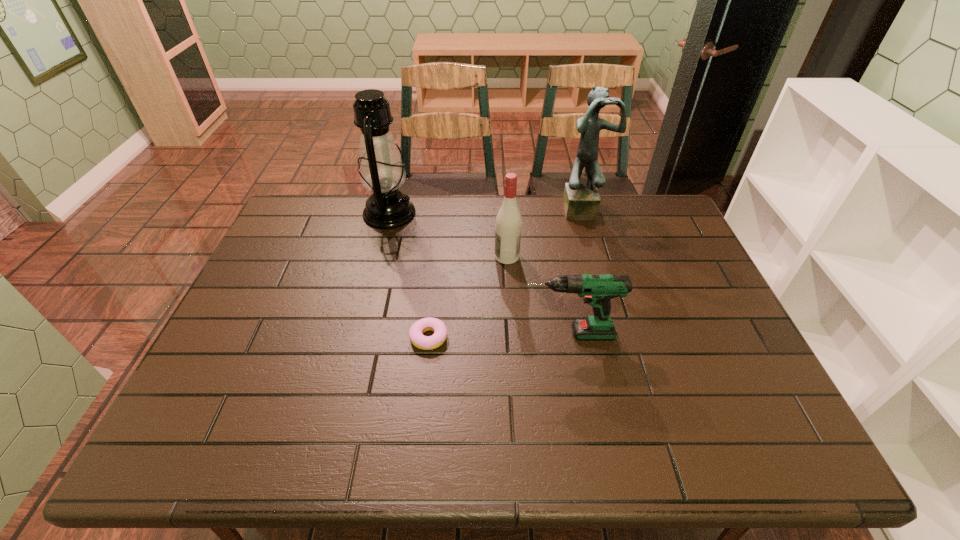
Locate an element on the screen. The height and width of the screenshot is (540, 960). oil lamp is located at coordinates (381, 169).

Locate an element on the screen. This screenshot has width=960, height=540. sculpture is located at coordinates point(581,201).

This screenshot has height=540, width=960. Identify the location of the third farthest object. pyautogui.click(x=508, y=227).

The image size is (960, 540). I want to click on alcohol, so click(508, 227).

Locate an element on the screen. This screenshot has width=960, height=540. the fourth tallest object is located at coordinates (597, 290).

Locate an element on the screen. This screenshot has height=540, width=960. doughnut is located at coordinates (416, 331).

The height and width of the screenshot is (540, 960). In order to click on the shortest object in this screenshot , I will do `click(416, 331)`.

This screenshot has height=540, width=960. I want to click on vacant region located on the right of the oil lamp, so click(x=511, y=214).

Image resolution: width=960 pixels, height=540 pixels. In order to click on free region located on the face of the sculpture in this screenshot , I will do `click(597, 261)`.

At what (x,y) coordinates should I click in order to perform the action: click on blank space located 0.240m on the label of the alcohol. Please return your answer as a coordinate pair (x, y). This screenshot has width=960, height=540. Looking at the image, I should click on (417, 256).